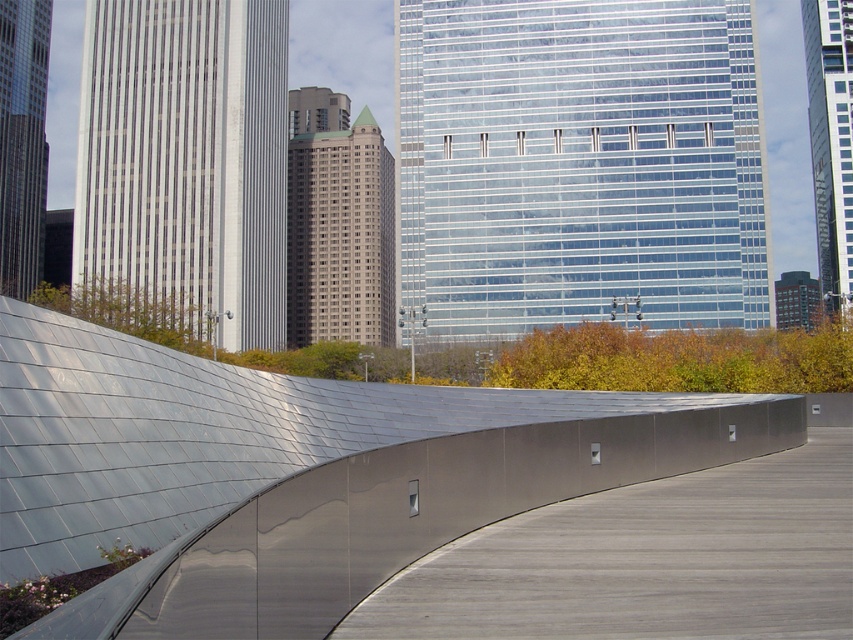
From the picture: How much distance is there between silver metallic ramp at center and satin silver wall at center?

A distance of 4.67 meters exists between silver metallic ramp at center and satin silver wall at center.

Identify the location of silver metallic ramp at center. This screenshot has height=640, width=853. [294, 474].

Is point (299, 406) farther from camera compared to point (821, 596)?

Yes, it is behind point (821, 596).

The height and width of the screenshot is (640, 853). In order to click on silver metallic ramp at center in this screenshot , I will do `click(294, 474)`.